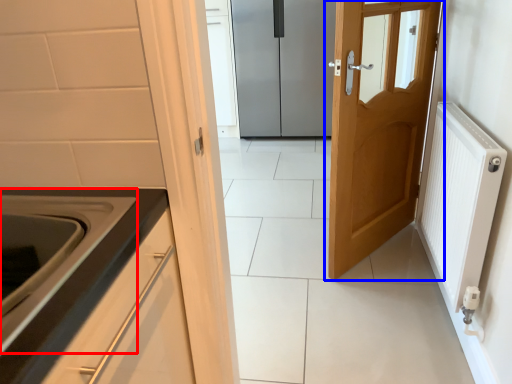
Question: Among these objects, which one is nearest to the camera, oven (highlighted by a red box) or door (highlighted by a blue box)?

Choices:
 (A) oven
 (B) door

Answer: (A)